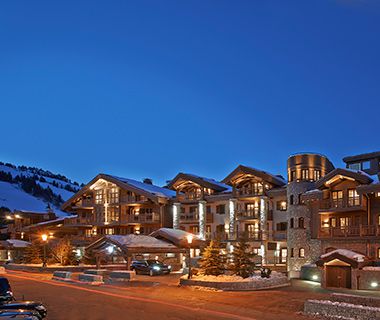
Locate an element on the screen. This screenshot has height=320, width=380. pillars is located at coordinates (201, 218), (177, 213), (231, 214).